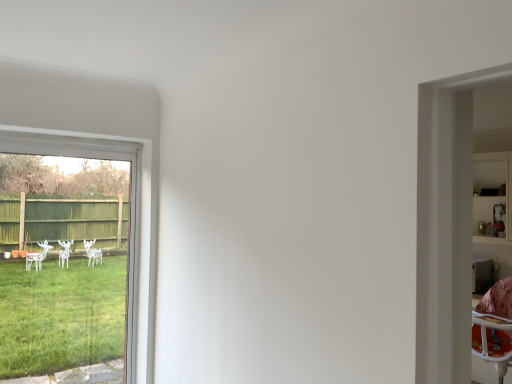
Question: In terms of height, does transparent glass window at left look taller or shorter compared to wooden shelf at right?

Choices:
 (A) tall
 (B) short

Answer: (A)

Question: In the image, is transparent glass window at left positioned in front of or behind wooden shelf at right?

Choices:
 (A) front
 (B) behind

Answer: (A)

Question: Considering the positions of transparent glass window at left and wooden shelf at right in the image, is transparent glass window at left bigger or smaller than wooden shelf at right?

Choices:
 (A) big
 (B) small

Answer: (B)

Question: Is wooden shelf at right wider or thinner than transparent glass window at left?

Choices:
 (A) wide
 (B) thin

Answer: (A)

Question: Considering their positions, is wooden shelf at right located in front of or behind transparent glass window at left?

Choices:
 (A) front
 (B) behind

Answer: (B)

Question: Considering the positions of wooden shelf at right and transparent glass window at left in the image, is wooden shelf at right taller or shorter than transparent glass window at left?

Choices:
 (A) short
 (B) tall

Answer: (A)

Question: Is wooden shelf at right inside or outside of transparent glass window at left?

Choices:
 (A) inside
 (B) outside

Answer: (B)